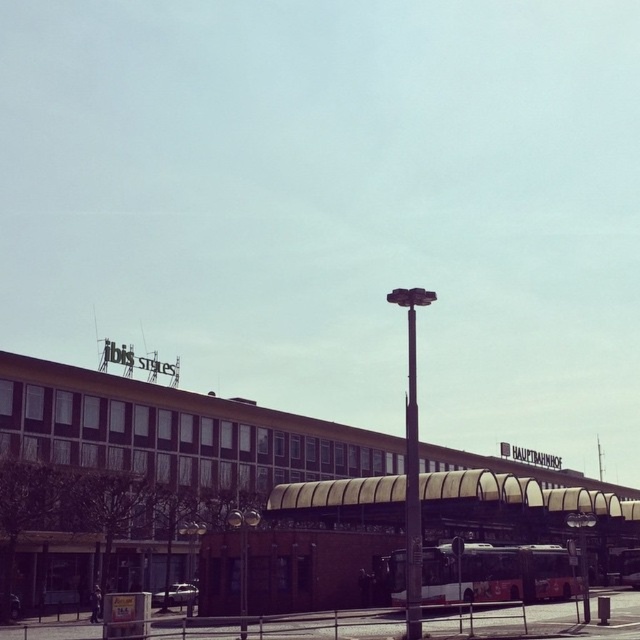
Question: Which point is farther to the camera?

Choices:
 (A) (412, 362)
 (B) (388, 300)

Answer: (A)

Question: Can you confirm if metallic pole at center is bigger than black metal pole at center?

Choices:
 (A) no
 (B) yes

Answer: (B)

Question: Which of the following is the farthest from the observer?

Choices:
 (A) white glass bus station at center
 (B) black metal pole at center

Answer: (A)

Question: Does white glass bus station at center appear under metallic pole at center?

Choices:
 (A) yes
 (B) no

Answer: (A)

Question: Which of the following is the closest to the observer?

Choices:
 (A) black metal pole at center
 (B) white glass bus station at center
 (C) metallic pole at center

Answer: (C)

Question: Does metallic pole at center appear on the right side of black metal pole at center?

Choices:
 (A) no
 (B) yes

Answer: (B)